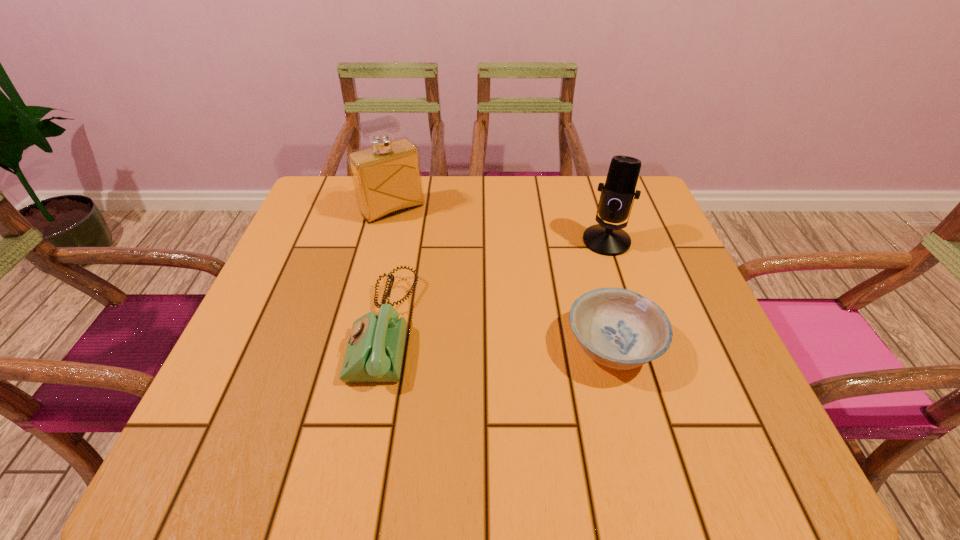
Identify the location of free space located 0.080m on the stand of the third nearest object. (582, 273).

Identify the location of vacant space located on the stand of the third nearest object. The image size is (960, 540). (563, 297).

I want to click on perfume at the far edge, so click(387, 178).

The width and height of the screenshot is (960, 540). What are the coordinates of `microphone positioned at the far edge` in the screenshot? It's located at (616, 198).

The image size is (960, 540). Identify the location of telephone located at the near edge. (374, 353).

Locate an element on the screen. Image resolution: width=960 pixels, height=540 pixels. bowl that is at the near edge is located at coordinates (618, 328).

This screenshot has height=540, width=960. I want to click on object that is at the left edge, so click(x=387, y=178).

Locate an element on the screen. This screenshot has height=540, width=960. bowl at the right edge is located at coordinates (618, 328).

Identify the location of microphone situated at the right edge. pos(616,198).

I want to click on object that is at the far left corner, so click(387, 178).